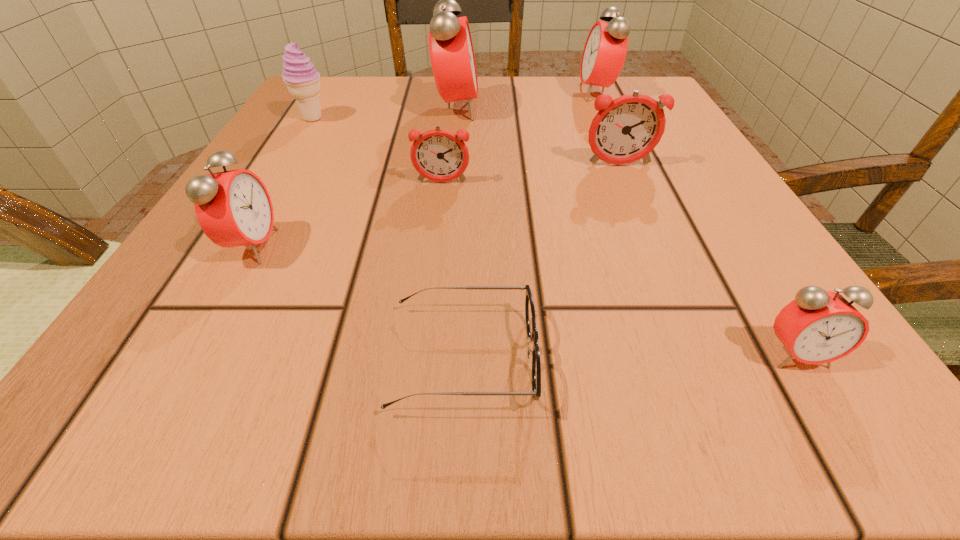
The height and width of the screenshot is (540, 960). Find the location of `object present at the far right corner`. object present at the far right corner is located at coordinates (x=604, y=54).

Locate an element on the screen. The image size is (960, 540). object that is at the near right corner is located at coordinates (819, 326).

In the image, there is a desktop. Where is `free region at the far edge`? This screenshot has width=960, height=540. free region at the far edge is located at coordinates (581, 126).

Image resolution: width=960 pixels, height=540 pixels. In the image, there is a desktop. Find the location of `blank space at the near edge`. blank space at the near edge is located at coordinates (584, 396).

The image size is (960, 540). In the image, there is a desktop. Find the location of `free space at the left edge`. free space at the left edge is located at coordinates 276,204.

In the image, there is a desktop. At what (x,y) coordinates should I click in order to perform the action: click on vacant space at the right edge. Please return your answer as a coordinate pair (x, y). Looking at the image, I should click on point(693,193).

I want to click on free space between the nearest red alarm clock and the fourth nearest object, so [619, 268].

At what (x,y) coordinates should I click in order to perform the action: click on vacant space that's between the fourth nearest alarm clock and the rightmost alarm clock. Please return your answer as a coordinate pair (x, y). This screenshot has height=540, width=960. Looking at the image, I should click on (708, 260).

Locate an element on the screen. vacant space that is in between the nearest alarm clock and the farther reddish-pink alarm clock is located at coordinates (708, 260).

Find the location of `free space between the nearest red alarm clock and the sixth farthest object`. free space between the nearest red alarm clock and the sixth farthest object is located at coordinates (524, 300).